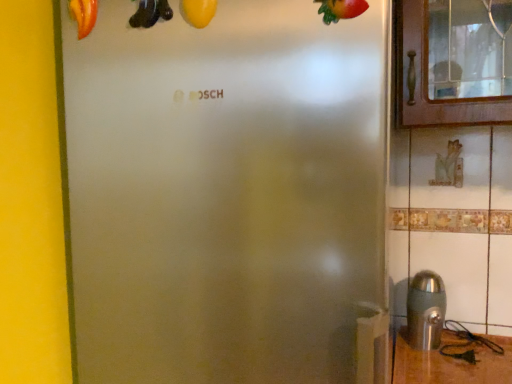
Question: Is matte red tomato at upper left, which is the third fruit from right to left, to the right of stainless steel at lower right from the viewer's perspective?

Choices:
 (A) yes
 (B) no

Answer: (B)

Question: From the image's perspective, is matte red tomato at upper left, which is counted as the first fruit, starting from the back, beneath stainless steel at lower right?

Choices:
 (A) no
 (B) yes

Answer: (A)

Question: Is matte red tomato at upper left, which is the third fruit from right to left, oriented away from stainless steel at lower right?

Choices:
 (A) no
 (B) yes

Answer: (A)

Question: Can you confirm if matte red tomato at upper left, positioned as the 1th fruit in left-to-right order, is wider than stainless steel at lower right?

Choices:
 (A) no
 (B) yes

Answer: (A)

Question: Considering the relative sizes of matte red tomato at upper left, positioned as the 1th fruit in left-to-right order, and stainless steel at lower right in the image provided, is matte red tomato at upper left, positioned as the 1th fruit in left-to-right order, bigger than stainless steel at lower right?

Choices:
 (A) no
 (B) yes

Answer: (A)

Question: Considering the positions of shiny red strawberry at upper right, arranged as the third fruit when viewed from the back, and yellow matte squash at upper center, the 2th fruit in the left-to-right sequence, in the image, is shiny red strawberry at upper right, arranged as the third fruit when viewed from the back, taller or shorter than yellow matte squash at upper center, the 2th fruit in the left-to-right sequence,?

Choices:
 (A) short
 (B) tall

Answer: (A)

Question: Considering the positions of shiny red strawberry at upper right, which is the 3th fruit from left to right, and yellow matte squash at upper center, marked as the second fruit in a right-to-left arrangement, in the image, is shiny red strawberry at upper right, which is the 3th fruit from left to right, wider or thinner than yellow matte squash at upper center, marked as the second fruit in a right-to-left arrangement,?

Choices:
 (A) thin
 (B) wide

Answer: (A)

Question: From the image's perspective, relative to yellow matte squash at upper center, positioned as the 2th fruit in back-to-front order, is shiny red strawberry at upper right, marked as the first fruit in a right-to-left arrangement, above or below?

Choices:
 (A) above
 (B) below

Answer: (B)

Question: In terms of size, does shiny red strawberry at upper right, marked as the first fruit in a right-to-left arrangement, appear bigger or smaller than yellow matte squash at upper center, which appears as the 2th fruit when viewed from the front?

Choices:
 (A) small
 (B) big

Answer: (B)

Question: Would you say stainless steel at lower right is to the left or to the right of yellow matte banana at upper center in the picture?

Choices:
 (A) right
 (B) left

Answer: (A)

Question: From the image's perspective, relative to yellow matte banana at upper center, is stainless steel at lower right above or below?

Choices:
 (A) below
 (B) above

Answer: (A)

Question: Relative to yellow matte banana at upper center, is stainless steel at lower right in front or behind?

Choices:
 (A) behind
 (B) front

Answer: (A)

Question: In terms of width, does stainless steel at lower right look wider or thinner when compared to yellow matte banana at upper center?

Choices:
 (A) thin
 (B) wide

Answer: (B)

Question: Do you think matte red tomato at upper left, which is counted as the first fruit, starting from the back, is within stainless steel at lower right, or outside of it?

Choices:
 (A) outside
 (B) inside

Answer: (A)

Question: Considering the positions of matte red tomato at upper left, acting as the third fruit starting from the front, and stainless steel at lower right in the image, is matte red tomato at upper left, acting as the third fruit starting from the front, taller or shorter than stainless steel at lower right?

Choices:
 (A) tall
 (B) short

Answer: (B)